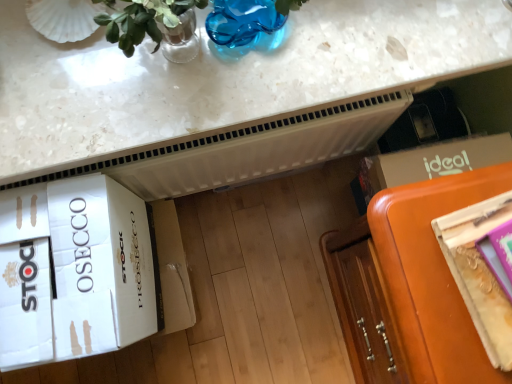
Question: Are white cardboard box at lower left and orange leather couch at lower right located far from each other?

Choices:
 (A) no
 (B) yes

Answer: (A)

Question: Is white cardboard box at lower left with orange leather couch at lower right?

Choices:
 (A) no
 (B) yes

Answer: (A)

Question: Does white cardboard box at lower left have a smaller size compared to orange leather couch at lower right?

Choices:
 (A) no
 (B) yes

Answer: (B)

Question: Is orange leather couch at lower right inside white cardboard box at lower left?

Choices:
 (A) yes
 (B) no

Answer: (B)

Question: From the image's perspective, is white cardboard box at lower left over orange leather couch at lower right?

Choices:
 (A) no
 (B) yes

Answer: (B)

Question: Considering the relative sizes of white cardboard box at lower left and orange leather couch at lower right in the image provided, is white cardboard box at lower left thinner than orange leather couch at lower right?

Choices:
 (A) no
 (B) yes

Answer: (B)

Question: Does metallic gold magazine at right turn towards white cardboard box at lower left?

Choices:
 (A) yes
 (B) no

Answer: (B)

Question: Is metallic gold magazine at right beside white cardboard box at lower left?

Choices:
 (A) no
 (B) yes

Answer: (A)

Question: Considering the relative sizes of metallic gold magazine at right and white cardboard box at lower left in the image provided, is metallic gold magazine at right shorter than white cardboard box at lower left?

Choices:
 (A) yes
 (B) no

Answer: (A)

Question: From a real-world perspective, is metallic gold magazine at right under white cardboard box at lower left?

Choices:
 (A) no
 (B) yes

Answer: (A)

Question: Is metallic gold magazine at right oriented away from white cardboard box at lower left?

Choices:
 (A) no
 (B) yes

Answer: (A)

Question: Is metallic gold magazine at right at the right side of white cardboard box at lower left?

Choices:
 (A) yes
 (B) no

Answer: (A)

Question: Is metallic gold magazine at right outside orange leather couch at lower right?

Choices:
 (A) yes
 (B) no

Answer: (B)